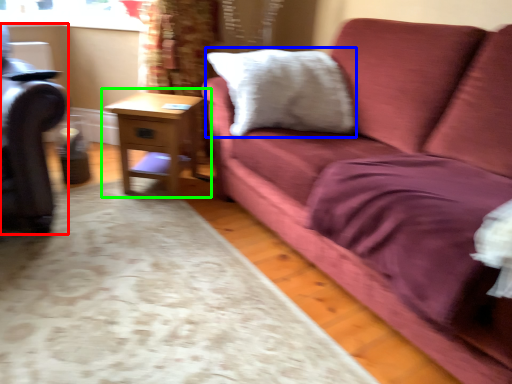
Question: Based on their relative distances, which object is nearer to swivel chair (highlighted by a red box)? Choose from pillow (highlighted by a blue box) and table (highlighted by a green box).

Choices:
 (A) pillow
 (B) table

Answer: (B)